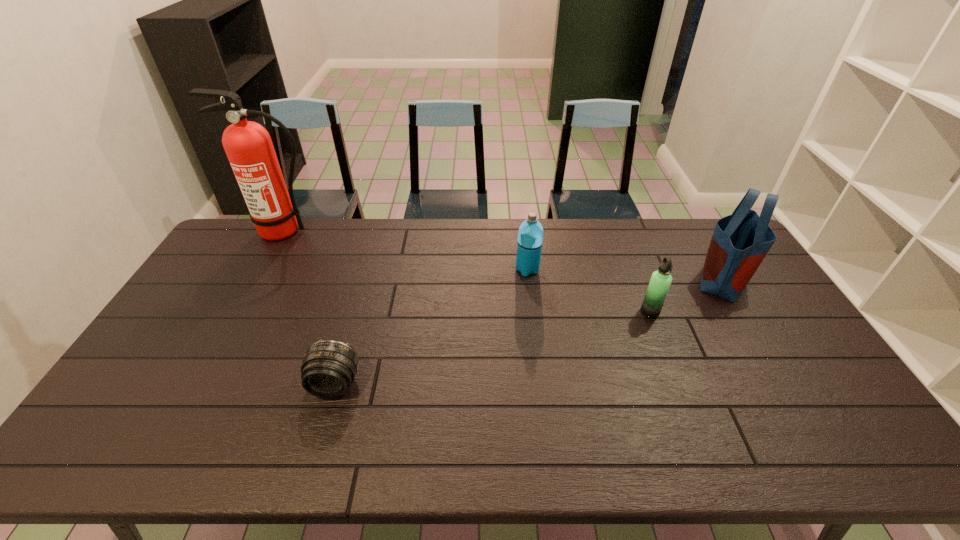
In order to click on the tallest object in this screenshot , I will do `click(249, 148)`.

Image resolution: width=960 pixels, height=540 pixels. What are the coordinates of `the farthest object` in the screenshot? It's located at (249, 148).

Where is `the fourth shortest object`? This screenshot has height=540, width=960. the fourth shortest object is located at coordinates (740, 242).

Locate an element on the screen. Image resolution: width=960 pixels, height=540 pixels. handbag is located at coordinates (740, 242).

This screenshot has width=960, height=540. I want to click on the farther thermos bottle, so click(x=530, y=236).

At what (x,y) coordinates should I click in order to perform the action: click on the third object from left to right. Please return your answer as a coordinate pair (x, y). This screenshot has width=960, height=540. Looking at the image, I should click on (530, 236).

Find the location of a particular element. the fourth farthest object is located at coordinates click(x=660, y=282).

At what (x,y) coordinates should I click in order to perform the action: click on the nearer thermos bottle. Please return your answer as a coordinate pair (x, y). The image size is (960, 540). Looking at the image, I should click on (660, 282).

Find the location of a particular element. The width and height of the screenshot is (960, 540). the nearest object is located at coordinates (328, 368).

I want to click on telephoto lens, so click(x=328, y=368).